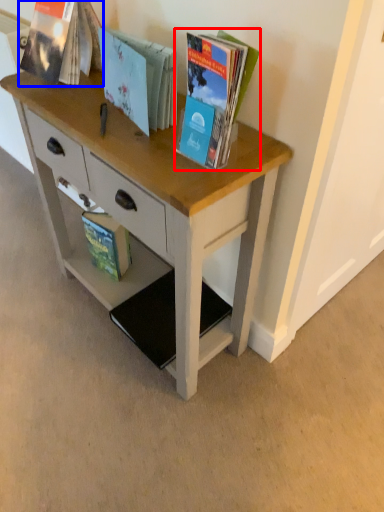
Question: Which object appears closest to the camera in this image, book (highlighted by a red box) or book (highlighted by a blue box)?

Choices:
 (A) book
 (B) book

Answer: (A)